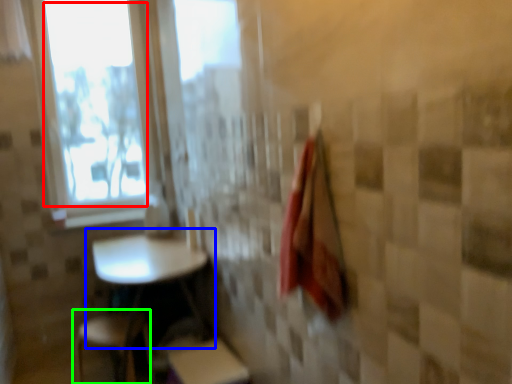
Question: Which object is the farthest from window screen (highlighted by a red box)? Choose among these: table (highlighted by a blue box) or step stool (highlighted by a green box).

Choices:
 (A) table
 (B) step stool

Answer: (B)